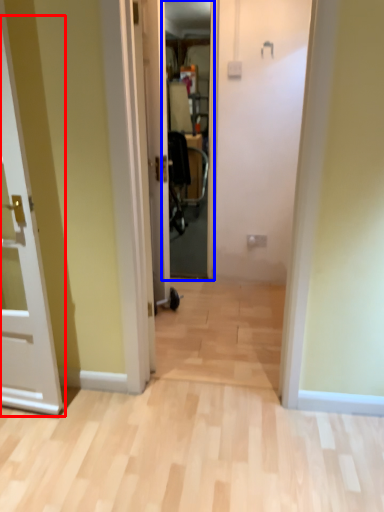
Question: Which object appears farthest to the camera in this image, door (highlighted by a red box) or screen door (highlighted by a blue box)?

Choices:
 (A) door
 (B) screen door

Answer: (B)